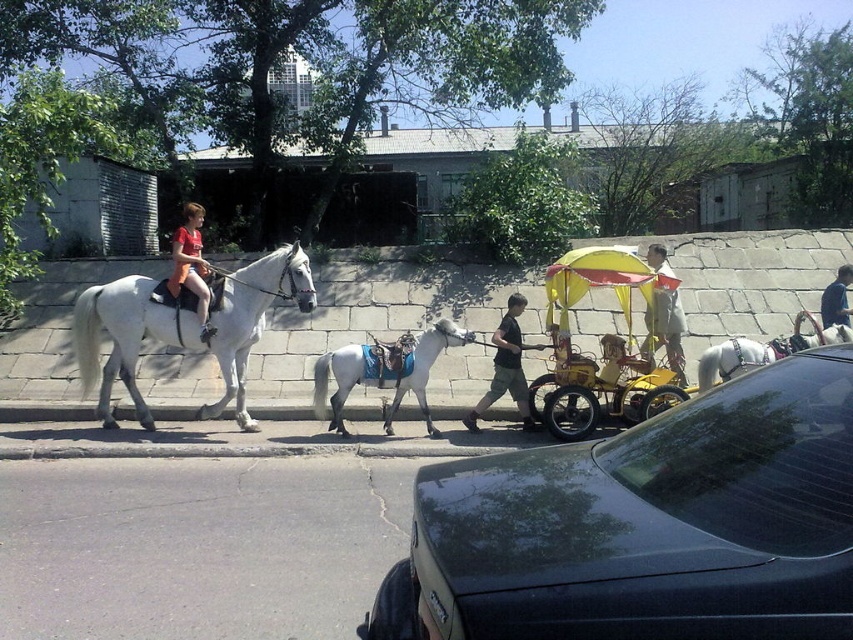
Is point (368, 364) farther from viewer compared to point (503, 381)?

No.

Does light gray glossy horse at center appear on the left side of black cotton shirt at center?

Correct, you'll find light gray glossy horse at center to the left of black cotton shirt at center.

What do you see at coordinates (386, 371) in the screenshot?
I see `light gray glossy horse at center` at bounding box center [386, 371].

This screenshot has height=640, width=853. I want to click on light gray glossy horse at center, so click(x=386, y=371).

From the picture: Does light gray glossy horse at center have a larger size compared to dark blue shirt at center?

Yes.

Between light gray glossy horse at center and dark blue shirt at center, which one has less height?

With less height is dark blue shirt at center.

The width and height of the screenshot is (853, 640). Find the location of `light gray glossy horse at center`. light gray glossy horse at center is located at coordinates (386, 371).

What are the coordinates of `white glossy horse at left` in the screenshot? It's located at (184, 328).

The width and height of the screenshot is (853, 640). Find the location of `white glossy horse at left`. white glossy horse at left is located at coordinates (184, 328).